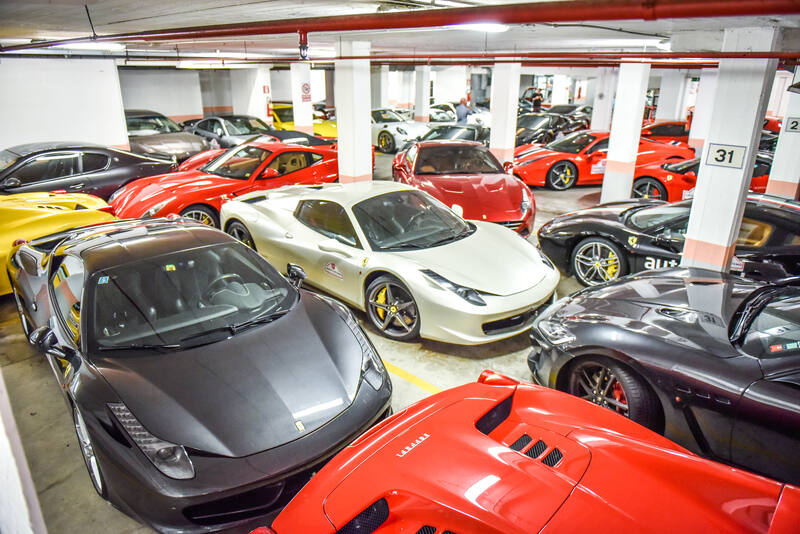
This screenshot has width=800, height=534. What are the coordinates of `walls` in the screenshot? It's located at (165, 82), (86, 100), (218, 90), (281, 81), (324, 78).